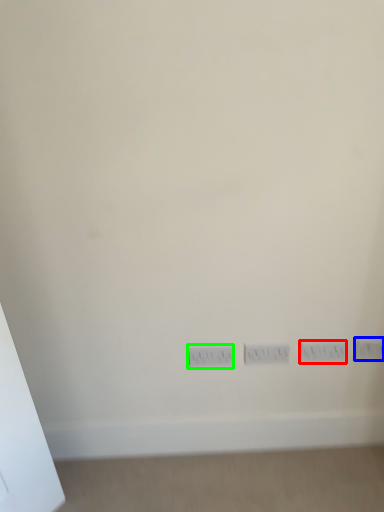
Question: Which object is positioned farthest from electric outlet (highlighted by a red box)? Select from electric outlet (highlighted by a blue box) and power plugs and sockets (highlighted by a green box).

Choices:
 (A) electric outlet
 (B) power plugs and sockets

Answer: (B)